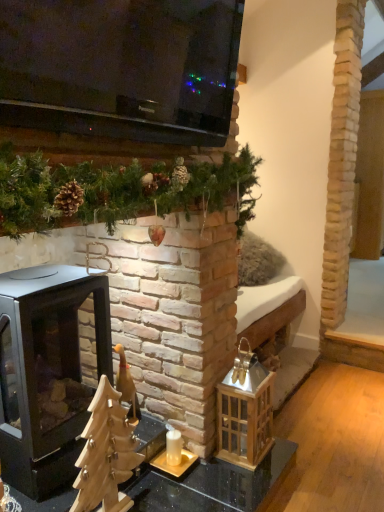
I want to click on gold metallic candle holder at center, so pos(174,455).

What do you see at coordinates (174, 455) in the screenshot?
I see `gold metallic candle holder at center` at bounding box center [174, 455].

The image size is (384, 512). What do you see at coordinates (46, 373) in the screenshot? I see `black matte wood burning stove at left` at bounding box center [46, 373].

I want to click on black matte wood burning stove at left, so click(x=46, y=373).

The image size is (384, 512). What are the coordinates of `gold metallic candle holder at center` in the screenshot? It's located at (174, 455).

Is black matte wood burning stove at left to the left or to the right of gold metallic candle holder at center in the image?

Based on their positions, black matte wood burning stove at left is located to the left of gold metallic candle holder at center.

Does black matte wood burning stove at left come in front of gold metallic candle holder at center?

Yes.

Considering the points (51, 278) and (177, 468), which point is behind, point (51, 278) or point (177, 468)?

The point (177, 468) is farther.

From the image's perspective, is black matte wood burning stove at left under gold metallic candle holder at center?

No, from the image's perspective, black matte wood burning stove at left is not below gold metallic candle holder at center.

From a real-world perspective, is black matte wood burning stove at left beneath gold metallic candle holder at center?

Incorrect, from a real-world perspective, black matte wood burning stove at left is higher than gold metallic candle holder at center.

Considering the relative sizes of black matte wood burning stove at left and gold metallic candle holder at center in the image provided, is black matte wood burning stove at left thinner than gold metallic candle holder at center?

Incorrect, the width of black matte wood burning stove at left is not less than that of gold metallic candle holder at center.

Considering the sizes of objects black matte wood burning stove at left and gold metallic candle holder at center in the image provided, who is shorter, black matte wood burning stove at left or gold metallic candle holder at center?

gold metallic candle holder at center.

Based on their sizes in the image, would you say black matte wood burning stove at left is bigger or smaller than gold metallic candle holder at center?

In the image, black matte wood burning stove at left appears to be larger than gold metallic candle holder at center.

Is black matte wood burning stove at left positioned beyond the bounds of gold metallic candle holder at center?

Yes, black matte wood burning stove at left is located beyond the bounds of gold metallic candle holder at center.

Is black matte wood burning stove at left placed right next to gold metallic candle holder at center?

black matte wood burning stove at left and gold metallic candle holder at center are not in contact.

Is black matte wood burning stove at left facing away from gold metallic candle holder at center?

That's not correct — black matte wood burning stove at left is not looking away from gold metallic candle holder at center.

What's the angular difference between black matte wood burning stove at left and gold metallic candle holder at center's facing directions?

The facing directions of black matte wood burning stove at left and gold metallic candle holder at center are 0.00388 degrees apart.

You are a GUI agent. You are given a task and a screenshot of the screen. Output one action in this format:
    pyautogui.click(x=<x>, y=<y>)
    Task: Click on the wood burning stove above the gold metallic candle holder at center (from a real-world perspective)
    This screenshot has width=384, height=512.
    Given the screenshot: What is the action you would take?
    pyautogui.click(x=46, y=373)

Between gold metallic candle holder at center and black matte wood burning stove at left, which one appears on the left side from the viewer's perspective?

black matte wood burning stove at left.

Considering the positions of objects gold metallic candle holder at center and black matte wood burning stove at left in the image provided, who is behind, gold metallic candle holder at center or black matte wood burning stove at left?

gold metallic candle holder at center is further from the camera.

Which point is more forward, (x=152, y=464) or (x=16, y=288)?

The point (x=16, y=288) is closer to the camera.

From the image's perspective, does gold metallic candle holder at center appear lower than black matte wood burning stove at left?

Yes, from the image's perspective, gold metallic candle holder at center is beneath black matte wood burning stove at left.

From a real-world perspective, is gold metallic candle holder at center under black matte wood burning stove at left?

Correct, in the physical world, gold metallic candle holder at center is lower than black matte wood burning stove at left.

Between gold metallic candle holder at center and black matte wood burning stove at left, which one has larger width?

With larger width is black matte wood burning stove at left.

Considering the sizes of gold metallic candle holder at center and black matte wood burning stove at left in the image, is gold metallic candle holder at center taller or shorter than black matte wood burning stove at left?

gold metallic candle holder at center is shorter than black matte wood burning stove at left.

Is gold metallic candle holder at center smaller than black matte wood burning stove at left?

Indeed, gold metallic candle holder at center has a smaller size compared to black matte wood burning stove at left.

Is black matte wood burning stove at left a part of gold metallic candle holder at center?

Definitely not — black matte wood burning stove at left is not inside gold metallic candle holder at center.

Is there a large distance between gold metallic candle holder at center and black matte wood burning stove at left?

No, gold metallic candle holder at center is in close proximity to black matte wood burning stove at left.

Is black matte wood burning stove at left at the back of gold metallic candle holder at center?

No, gold metallic candle holder at center is not facing the opposite direction of black matte wood burning stove at left.

How different are the orientations of gold metallic candle holder at center and black matte wood burning stove at left in degrees?

There is a 0.00388-degree angle between the facing directions of gold metallic candle holder at center and black matte wood burning stove at left.

Measure the distance from gold metallic candle holder at center to black matte wood burning stove at left.

gold metallic candle holder at center is 25.61 inches away from black matte wood burning stove at left.

At what (x,y) coordinates should I click in order to perform the action: click on candle holder that appears behind the black matte wood burning stove at left. Please return your answer as a coordinate pair (x, y). Looking at the image, I should click on (174, 455).

Identify the location of candle holder that is on the right side of black matte wood burning stove at left. The height and width of the screenshot is (512, 384). (174, 455).

The image size is (384, 512). In the image, there is a black matte wood burning stove at left. In order to click on candle holder below it (from a real-world perspective) in this screenshot , I will do `click(174, 455)`.